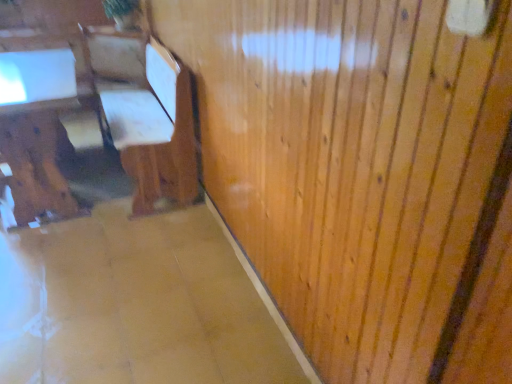
The width and height of the screenshot is (512, 384). What are the coordinates of `wooden chair at left` in the screenshot? It's located at (95, 116).

What do you see at coordinates (95, 116) in the screenshot?
I see `wooden chair at left` at bounding box center [95, 116].

In the scene shown: What is the approximate width of wooden chair at left?

The width of wooden chair at left is 1.15 meters.

Locate an element on the screen. This screenshot has height=384, width=512. matte brown table at left is located at coordinates (36, 129).

What do you see at coordinates (36, 129) in the screenshot? The image size is (512, 384). I see `matte brown table at left` at bounding box center [36, 129].

You are a GUI agent. You are given a task and a screenshot of the screen. Output one action in this format:
    pyautogui.click(x=<x>, y=<y>)
    Task: Click on the wooden chair at left
    
    Given the screenshot: What is the action you would take?
    pyautogui.click(x=95, y=116)

Which object is positioned more to the left, wooden chair at left or matte brown table at left?

matte brown table at left is more to the left.

Relative to matte brown table at left, is wooden chair at left in front or behind?

wooden chair at left is positioned closer to the viewer than matte brown table at left.

Which is behind, point (141, 120) or point (60, 212)?

The point (141, 120) is more distant.

From the image's perspective, is wooden chair at left above or below matte brown table at left?

From the image's perspective, wooden chair at left appears above matte brown table at left.

From a real-world perspective, who is located higher, wooden chair at left or matte brown table at left?

In real-world perspective, wooden chair at left is above.

In terms of width, does wooden chair at left look wider or thinner when compared to matte brown table at left?

Considering their sizes, wooden chair at left looks broader than matte brown table at left.

Is wooden chair at left shorter than matte brown table at left?

No.

Is wooden chair at left smaller than matte brown table at left?

No.

Is wooden chair at left inside or outside of matte brown table at left?

wooden chair at left is not enclosed by matte brown table at left.

Is wooden chair at left next to matte brown table at left and touching it?

No.

Is wooden chair at left oriented away from matte brown table at left?

Yes, wooden chair at left is facing away from matte brown table at left.

Can you tell me how much wooden chair at left and matte brown table at left differ in facing direction?

The facing directions of wooden chair at left and matte brown table at left are 89.6 degrees apart.

Measure the distance between wooden chair at left and matte brown table at left.

wooden chair at left and matte brown table at left are 19.74 inches apart.

The image size is (512, 384). Find the location of `furniture located above the matte brown table at left (from the image's perspective)`. furniture located above the matte brown table at left (from the image's perspective) is located at coordinates coord(95,116).

Can you confirm if matte brown table at left is positioned to the left of wooden chair at left?

Yes.

Who is more distant, matte brown table at left or wooden chair at left?

matte brown table at left.

Does point (19, 96) come in front of point (99, 53)?

That is True.

From the image's perspective, which one is positioned lower, matte brown table at left or wooden chair at left?

matte brown table at left is shown below in the image.

From a real-world perspective, is matte brown table at left located beneath wooden chair at left?

Yes, from a real-world perspective, matte brown table at left is under wooden chair at left.

Is matte brown table at left wider or thinner than wooden chair at left?

matte brown table at left is thinner than wooden chair at left.

Considering the relative sizes of matte brown table at left and wooden chair at left in the image provided, is matte brown table at left taller than wooden chair at left?

No, matte brown table at left is not taller than wooden chair at left.

Is matte brown table at left smaller than wooden chair at left?

Yes.

Is matte brown table at left outside of wooden chair at left?

No, matte brown table at left is inside wooden chair at left's boundary.

Is matte brown table at left beside wooden chair at left?

matte brown table at left and wooden chair at left are clearly separated.

Is matte brown table at left facing away from wooden chair at left?

Absolutely, matte brown table at left is directed away from wooden chair at left.

What's the angular difference between matte brown table at left and wooden chair at left's facing directions?

They differ by 89.6 degrees in their facing directions.

How far apart are matte brown table at left and wooden chair at left?

They are 50.13 centimeters apart.

At what (x,y) coordinates should I click in order to perform the action: click on furniture in front of the matte brown table at left. Please return your answer as a coordinate pair (x, y). This screenshot has width=512, height=384. Looking at the image, I should click on (95, 116).

The image size is (512, 384). In order to click on furniture in front of the matte brown table at left in this screenshot , I will do pos(95,116).

Identify the location of table lying on the left of wooden chair at left. (36, 129).